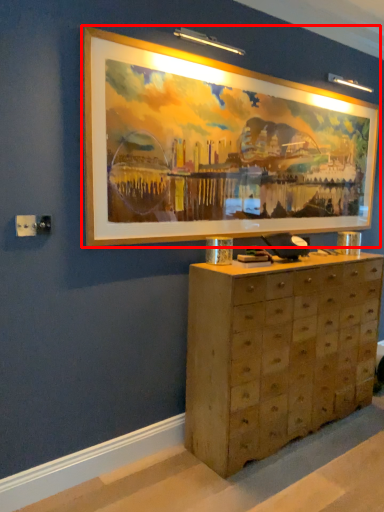
Question: Where is picture frame (annotated by the red box) located in relation to chest of drawers in the image?

Choices:
 (A) left
 (B) right

Answer: (A)